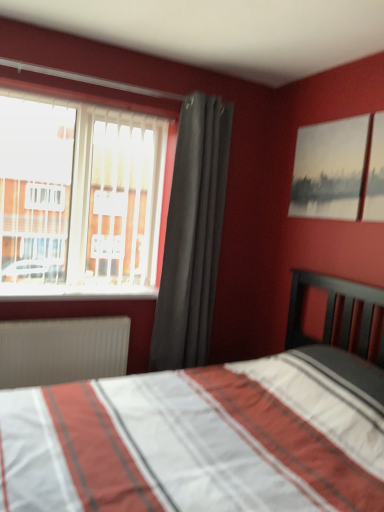
Question: Is point (193, 147) closer or farther from the camera than point (39, 286)?

Choices:
 (A) closer
 (B) farther

Answer: (B)

Question: From a real-world perspective, relative to white plastic window sill at left, is dark gray fabric curtain at center vertically above or below?

Choices:
 (A) above
 (B) below

Answer: (A)

Question: Estimate the real-world distances between objects in this image. Which object is closer to the white plastic window sill at left?

Choices:
 (A) transparent glass window at upper left
 (B) gray ribbed radiator at lower left
 (C) dark gray fabric curtain at center
 (D) matte gray painting at upper right

Answer: (B)

Question: Which object is the closest to the matte gray painting at upper right?

Choices:
 (A) transparent glass window at upper left
 (B) white plastic window sill at left
 (C) dark gray fabric curtain at center
 (D) gray ribbed radiator at lower left

Answer: (C)